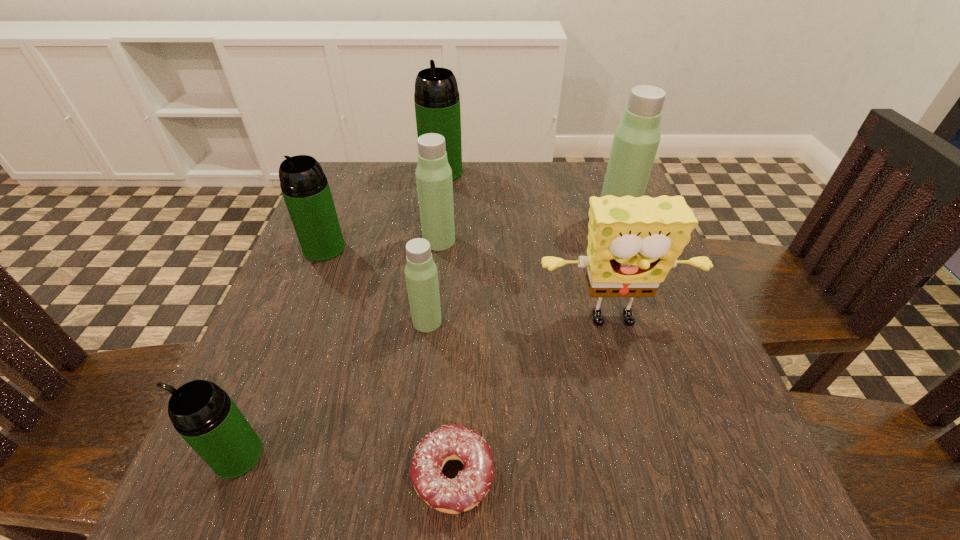
Locate an element on the screen. The image size is (960, 540). the nearest thermos bottle is located at coordinates point(205,416).

Find the location of a particular element. The height and width of the screenshot is (540, 960). the shortest object is located at coordinates (451, 441).

At what (x,y) coordinates should I click in order to perform the action: click on doughnut. Please return your answer as a coordinate pair (x, y). Image resolution: width=960 pixels, height=540 pixels. Looking at the image, I should click on (451, 441).

Find the location of `vacant region located from the spout of the farthest green thermos bottle`. vacant region located from the spout of the farthest green thermos bottle is located at coordinates [x=438, y=211].

At what (x,y) coordinates should I click in order to perform the action: click on blank space located 0.160m on the left of the rightmost light thermos bottle. Please return your answer as a coordinate pair (x, y). The height and width of the screenshot is (540, 960). Looking at the image, I should click on (527, 221).

You are a GUI agent. You are given a task and a screenshot of the screen. Output one action in this format:
    pyautogui.click(x=<x>, y=<y>)
    Task: Click on the free spot located from the spout of the second smallest green thermos bottle
    The height and width of the screenshot is (540, 960).
    Given the screenshot: What is the action you would take?
    pyautogui.click(x=274, y=377)

At what (x,y) coordinates should I click in order to perform the action: click on vacant space located on the right of the second biggest light thermos bottle. Please return your answer as a coordinate pair (x, y). Looking at the image, I should click on (624, 241).

Find the location of a particular element. The width and height of the screenshot is (960, 540). free space located 0.100m on the front-facing side of the yellow sponge is located at coordinates (635, 397).

Locate an element on the screen. vacant area situated 0.280m on the back of the smallest light thermos bottle is located at coordinates (439, 220).

At what (x,y) coordinates should I click in order to perform the action: click on vacant space located 0.320m on the right of the pink doughnut. Please return your answer as a coordinate pair (x, y). The width and height of the screenshot is (960, 540). Looking at the image, I should click on (728, 475).